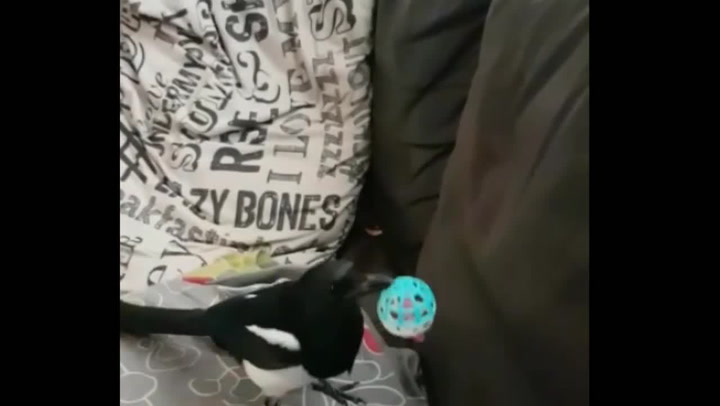
Where is `blue/white toy - plastic ball`? blue/white toy - plastic ball is located at coordinates (404, 295).